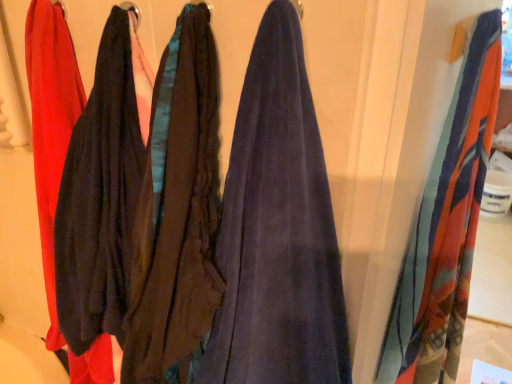
Question: Is matte black fabric at left shorter than printed silk scarf at right?

Choices:
 (A) yes
 (B) no

Answer: (A)

Question: Considering the relative sizes of matte black fabric at left and printed silk scarf at right in the image provided, is matte black fabric at left bigger than printed silk scarf at right?

Choices:
 (A) no
 (B) yes

Answer: (A)

Question: Is matte black fabric at left in contact with printed silk scarf at right?

Choices:
 (A) no
 (B) yes

Answer: (A)

Question: Considering the relative sizes of matte black fabric at left and printed silk scarf at right in the image provided, is matte black fabric at left smaller than printed silk scarf at right?

Choices:
 (A) yes
 (B) no

Answer: (A)

Question: Would you say matte black fabric at left contains printed silk scarf at right?

Choices:
 (A) yes
 (B) no

Answer: (B)

Question: From a real-world perspective, does matte black fabric at left sit lower than printed silk scarf at right?

Choices:
 (A) no
 (B) yes

Answer: (A)

Question: From the image's perspective, is printed silk scarf at right under matte black fabric at left?

Choices:
 (A) yes
 (B) no

Answer: (A)

Question: From a real-world perspective, is printed silk scarf at right located higher than matte black fabric at left?

Choices:
 (A) no
 (B) yes

Answer: (A)

Question: Is printed silk scarf at right thinner than matte black fabric at left?

Choices:
 (A) no
 (B) yes

Answer: (B)

Question: Does printed silk scarf at right have a lesser height compared to matte black fabric at left?

Choices:
 (A) no
 (B) yes

Answer: (A)

Question: Does printed silk scarf at right come in front of matte black fabric at left?

Choices:
 (A) no
 (B) yes

Answer: (A)

Question: Is printed silk scarf at right not inside matte black fabric at left?

Choices:
 (A) no
 (B) yes

Answer: (B)

Question: In the image, is matte black fabric at left on the left side or the right side of printed silk scarf at right?

Choices:
 (A) right
 (B) left

Answer: (B)